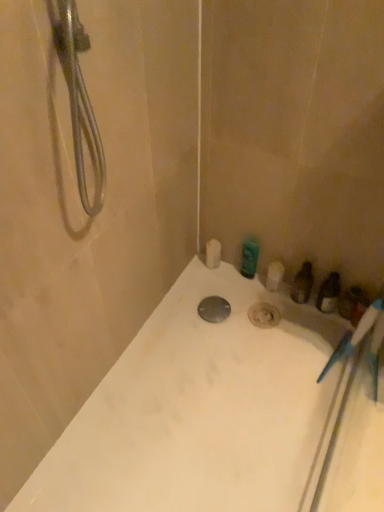
At what (x,y) coordinates should I click in order to perform the action: click on vacant region to the left of metallic silver drain at center. Please return your answer as a coordinate pair (x, y). The width and height of the screenshot is (384, 512). Looking at the image, I should click on (178, 321).